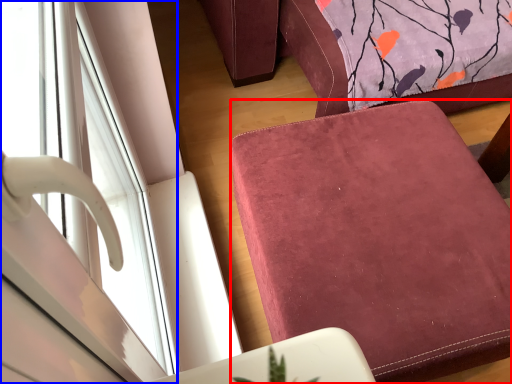
Question: Which object appears closest to the camera in this image, furniture (highlighted by a red box) or window (highlighted by a blue box)?

Choices:
 (A) furniture
 (B) window

Answer: (B)